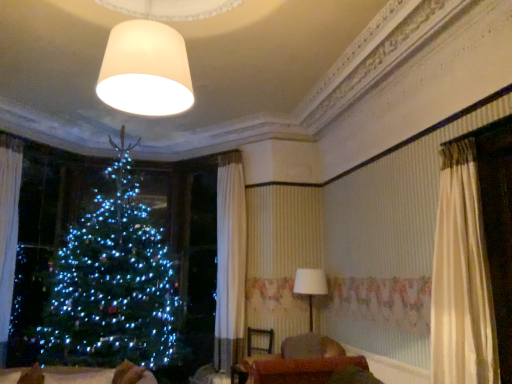
What is the approximate width of velvet brown sofa at lower center?

The width of velvet brown sofa at lower center is 39.24 inches.

Locate an element on the screen. The width and height of the screenshot is (512, 384). velvet brown sofa at lower center is located at coordinates (300, 362).

Describe the element at coordinates (8, 229) in the screenshot. Image resolution: width=512 pixels, height=384 pixels. I see `white sheer curtain at left` at that location.

You are a GUI agent. You are given a task and a screenshot of the screen. Output one action in this format:
    pyautogui.click(x=<x>, y=<y>)
    Task: Click on the velvet brown sofa at lower center
    This screenshot has width=512, height=384.
    Given the screenshot: What is the action you would take?
    pyautogui.click(x=300, y=362)

From a real-world perspective, is velvet brown armchair at center on top of matte white lampshade at upper center, acting as the first lamp starting from the top?

Actually, velvet brown armchair at center is physically below matte white lampshade at upper center, acting as the first lamp starting from the top, in the real world.

In terms of width, does velvet brown armchair at center look wider or thinner when compared to matte white lampshade at upper center, the 2th lamp viewed from the back?

Considering their sizes, velvet brown armchair at center looks slimmer than matte white lampshade at upper center, the 2th lamp viewed from the back.

Which is in front, velvet brown armchair at center or matte white lampshade at upper center, which is the second lamp in bottom-to-top order?

matte white lampshade at upper center, which is the second lamp in bottom-to-top order, is in front.

From the image's perspective, is velvet brown armchair at center beneath matte white lampshade at upper center, acting as the 1th lamp starting from the front?

Indeed, from the image's perspective, velvet brown armchair at center is shown beneath matte white lampshade at upper center, acting as the 1th lamp starting from the front.

From a real-world perspective, between matte white lampshade at upper center, the second lamp in the right-to-left sequence, and velvet brown armchair at center, who is vertically lower?

velvet brown armchair at center is physically lower.

From the image's perspective, is matte white lampshade at upper center, the second lamp in the right-to-left sequence, below velvet brown armchair at center?

Actually, matte white lampshade at upper center, the second lamp in the right-to-left sequence, appears above velvet brown armchair at center in the image.

Could you tell me if matte white lampshade at upper center, acting as the first lamp starting from the top, is turned towards velvet brown armchair at center?

No, matte white lampshade at upper center, acting as the first lamp starting from the top, is not aimed at velvet brown armchair at center.

Does matte white lampshade at upper center, which is the second lamp in bottom-to-top order, have a greater width compared to white fabric lampshade at center, acting as the 2th lamp starting from the left?

Yes, matte white lampshade at upper center, which is the second lamp in bottom-to-top order, is wider than white fabric lampshade at center, acting as the 2th lamp starting from the left.

Locate an element on the screen. This screenshot has width=512, height=384. lamp above the white fabric lampshade at center, the first lamp in the bottom-to-top sequence (from the image's perspective) is located at coordinates (148, 63).

Consider the image. Could you tell me if matte white lampshade at upper center, positioned as the 1th lamp in left-to-right order, is turned towards white fabric lampshade at center, the first lamp in the bottom-to-top sequence?

No, matte white lampshade at upper center, positioned as the 1th lamp in left-to-right order, is not aimed at white fabric lampshade at center, the first lamp in the bottom-to-top sequence.

Considering the positions of objects matte white lampshade at upper center, positioned as the 1th lamp in left-to-right order, and white fabric lampshade at center, the first lamp in the bottom-to-top sequence, in the image provided, who is in front, matte white lampshade at upper center, positioned as the 1th lamp in left-to-right order, or white fabric lampshade at center, the first lamp in the bottom-to-top sequence,?

matte white lampshade at upper center, positioned as the 1th lamp in left-to-right order, is more forward.

Between matte white lampshade at upper center, acting as the first lamp starting from the top, and white sheer curtain at left, which one has less height?

Standing shorter between the two is matte white lampshade at upper center, acting as the first lamp starting from the top.

Is matte white lampshade at upper center, acting as the 1th lamp starting from the front, at the right side of white sheer curtain at left?

Yes, matte white lampshade at upper center, acting as the 1th lamp starting from the front, is to the right of white sheer curtain at left.

From a real-world perspective, is matte white lampshade at upper center, positioned as the 1th lamp in left-to-right order, positioned above or below white sheer curtain at left?

matte white lampshade at upper center, positioned as the 1th lamp in left-to-right order, is situated higher than white sheer curtain at left in the real world.

How different are the orientations of matte white lampshade at upper center, the 2th lamp viewed from the back, and white sheer curtain at left in degrees?

39.3 degrees separate the facing orientations of matte white lampshade at upper center, the 2th lamp viewed from the back, and white sheer curtain at left.

Does white fabric lampshade at center, which is the first lamp from back to front, have a greater width compared to velvet brown sofa at lower center?

Incorrect, the width of white fabric lampshade at center, which is the first lamp from back to front, does not surpass that of velvet brown sofa at lower center.

Which is in front, point (311, 278) or point (313, 338)?

The point (313, 338) is more forward.

How different are the orientations of white fabric lampshade at center, the first lamp in the bottom-to-top sequence, and velvet brown sofa at lower center in degrees?

white fabric lampshade at center, the first lamp in the bottom-to-top sequence, and velvet brown sofa at lower center are facing 4.14 degrees away from each other.

Can velvet brown sofa at lower center be found inside white fabric lampshade at center, which is the first lamp from back to front?

No, velvet brown sofa at lower center is located outside of white fabric lampshade at center, which is the first lamp from back to front.

Between white sheer curtain at left and velvet brown armchair at center, which one has more height?

Standing taller between the two is white sheer curtain at left.

Do you think white sheer curtain at left is within velvet brown armchair at center, or outside of it?

white sheer curtain at left lies outside velvet brown armchair at center.

From the image's perspective, would you say white sheer curtain at left is positioned over velvet brown armchair at center?

Indeed, from the image's perspective, white sheer curtain at left is shown above velvet brown armchair at center.

Considering the sizes of objects white sheer curtain at left and velvet brown armchair at center in the image provided, who is bigger, white sheer curtain at left or velvet brown armchair at center?

With larger size is white sheer curtain at left.

Considering the positions of objects white fabric lampshade at center, which is the 2th lamp from top to bottom, and velvet brown armchair at center in the image provided, who is more to the left, white fabric lampshade at center, which is the 2th lamp from top to bottom, or velvet brown armchair at center?

Positioned to the left is velvet brown armchair at center.

From a real-world perspective, is white fabric lampshade at center, which is the first lamp from back to front, positioned above or below velvet brown armchair at center?

Clearly, from a real-world perspective, white fabric lampshade at center, which is the first lamp from back to front, is above velvet brown armchair at center.

Is white fabric lampshade at center, acting as the 2th lamp starting from the left, closer to the viewer compared to velvet brown armchair at center?

No, it is behind velvet brown armchair at center.

Consider the image. Between white fabric lampshade at center, the first lamp in the bottom-to-top sequence, and velvet brown armchair at center, which one has larger size?

With larger size is white fabric lampshade at center, the first lamp in the bottom-to-top sequence.

Locate an element on the screen. The height and width of the screenshot is (384, 512). armchair that is behind the matte white lampshade at upper center, which is the second lamp in bottom-to-top order is located at coordinates (261, 335).

At what (x,y) coordinates should I click in order to perform the action: click on lamp that is on the left side of velvet brown armchair at center. Please return your answer as a coordinate pair (x, y). The image size is (512, 384). Looking at the image, I should click on (148, 63).

Estimate the real-world distances between objects in this image. Which object is closer to white sheer curtain at left, white fabric lampshade at center, positioned as the 2th lamp in front-to-back order, or matte white lampshade at upper center, positioned as the 1th lamp in left-to-right order?

Based on the image, matte white lampshade at upper center, positioned as the 1th lamp in left-to-right order, appears to be nearer to white sheer curtain at left.

Considering their positions, is white fabric lampshade at center, acting as the 2th lamp starting from the left, positioned further to velvet brown armchair at center than velvet brown sofa at lower center?

velvet brown sofa at lower center lies further to velvet brown armchair at center than the other object.

From the image, which object appears to be nearer to white fabric lampshade at center, which is the 2th lamp from top to bottom, velvet brown armchair at center or white sheer curtain at left?

velvet brown armchair at center is positioned closer to the anchor white fabric lampshade at center, which is the 2th lamp from top to bottom.

Based on their spatial positions, is white fabric lampshade at center, the 1th lamp positioned from the right, or velvet brown sofa at lower center closer to matte white lampshade at upper center, which is the second lamp in bottom-to-top order?

velvet brown sofa at lower center is positioned closer to the anchor matte white lampshade at upper center, which is the second lamp in bottom-to-top order.

From the image, which object appears to be farther from white sheer curtain at left, velvet brown armchair at center or white fabric lampshade at center, positioned as the 2th lamp in front-to-back order?

Based on the image, white fabric lampshade at center, positioned as the 2th lamp in front-to-back order, appears to be further to white sheer curtain at left.

Estimate the real-world distances between objects in this image. Which object is closer to white fabric lampshade at center, the first lamp in the bottom-to-top sequence, velvet brown armchair at center or velvet brown sofa at lower center?

velvet brown armchair at center is positioned closer to the anchor white fabric lampshade at center, the first lamp in the bottom-to-top sequence.

Estimate the real-world distances between objects in this image. Which object is closer to white sheer curtain at left, matte white lampshade at upper center, the 2th lamp viewed from the back, or white fabric lampshade at center, the 1th lamp positioned from the right?

The object closer to white sheer curtain at left is matte white lampshade at upper center, the 2th lamp viewed from the back.

Based on their spatial positions, is velvet brown sofa at lower center or white sheer curtain at left closer to matte white lampshade at upper center, positioned as the 1th lamp in left-to-right order?

Among the two, velvet brown sofa at lower center is located nearer to matte white lampshade at upper center, positioned as the 1th lamp in left-to-right order.

You are a GUI agent. You are given a task and a screenshot of the screen. Output one action in this format:
    pyautogui.click(x=<x>, y=<y>)
    Task: Click on the armchair situated between white sheer curtain at left and velvet brown sofa at lower center from left to right
    This screenshot has height=384, width=512.
    Given the screenshot: What is the action you would take?
    pyautogui.click(x=261, y=335)

At what (x,y) coordinates should I click in order to perform the action: click on armchair between velvet brown sofa at lower center and white fabric lampshade at center, acting as the 2th lamp starting from the left, in the front-back direction. Please return your answer as a coordinate pair (x, y). Image resolution: width=512 pixels, height=384 pixels. Looking at the image, I should click on (261, 335).

Where is `armchair positioned between matte white lampshade at upper center, the second lamp in the right-to-left sequence, and white fabric lampshade at center, acting as the 2th lamp starting from the left, from near to far`? armchair positioned between matte white lampshade at upper center, the second lamp in the right-to-left sequence, and white fabric lampshade at center, acting as the 2th lamp starting from the left, from near to far is located at coordinates (261, 335).

At what (x,y) coordinates should I click in order to perform the action: click on furniture between white sheer curtain at left and white fabric lampshade at center, positioned as the 2th lamp in front-to-back order, in the horizontal direction. Please return your answer as a coordinate pair (x, y). Looking at the image, I should click on (300, 362).